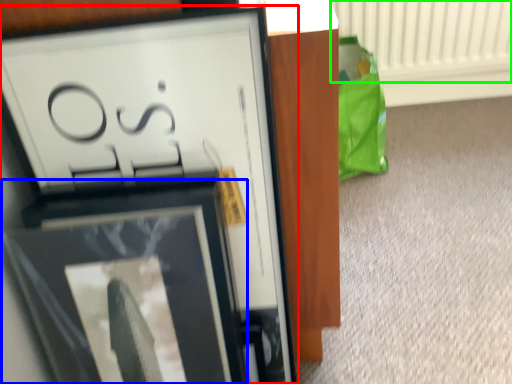
Question: Which object is the closest to the picture frame (highlighted by a red box)? Choose among these: picture frame (highlighted by a blue box) or radiator (highlighted by a green box).

Choices:
 (A) picture frame
 (B) radiator

Answer: (A)